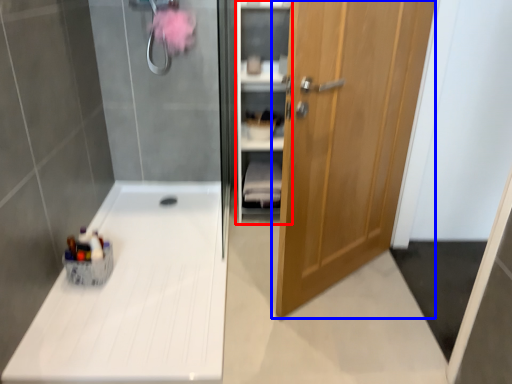
Question: Which of the following is the farthest to the observer, cabinet (highlighted by a red box) or door (highlighted by a blue box)?

Choices:
 (A) cabinet
 (B) door

Answer: (A)